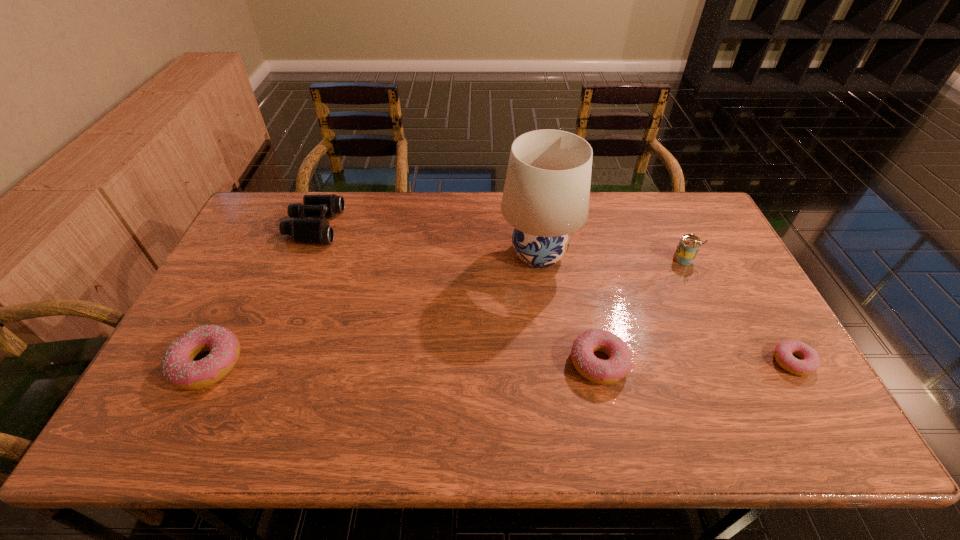
Where is `vacant space at the far right corner of the desktop`? This screenshot has height=540, width=960. vacant space at the far right corner of the desktop is located at coordinates (663, 207).

I want to click on free space at the near right corner of the desktop, so click(772, 388).

You are a GUI agent. You are given a task and a screenshot of the screen. Output one action in this format:
    pyautogui.click(x=<x>, y=<y>)
    Task: Click on the free space between the lampshade and the leftmost doughnut
    This screenshot has width=960, height=540.
    Given the screenshot: What is the action you would take?
    [x=373, y=309]

You are a GUI agent. You are given a task and a screenshot of the screen. Output one action in this format:
    pyautogui.click(x=<x>, y=<y>)
    Task: Click on the unoccupied area between the second object from right to left and the fourth shortest object
    This screenshot has width=960, height=540.
    Given the screenshot: What is the action you would take?
    pyautogui.click(x=499, y=242)

What are the coordinates of `vacant area that lies between the second shortest object and the can` in the screenshot? It's located at (641, 311).

I want to click on vacant area that lies between the leftmost doughnut and the binoculars, so click(x=261, y=295).

Identify the location of free space between the can and the lampshade. The image size is (960, 540). (612, 256).

Where is `vacant space that's between the rightmost object and the leftmost doughnut`? The image size is (960, 540). vacant space that's between the rightmost object and the leftmost doughnut is located at coordinates (500, 363).

I want to click on free space between the lampshade and the fourth shortest object, so click(426, 240).

The height and width of the screenshot is (540, 960). In order to click on free area in between the shortest doughnut and the second doughnut from left to right in this screenshot , I will do `click(695, 362)`.